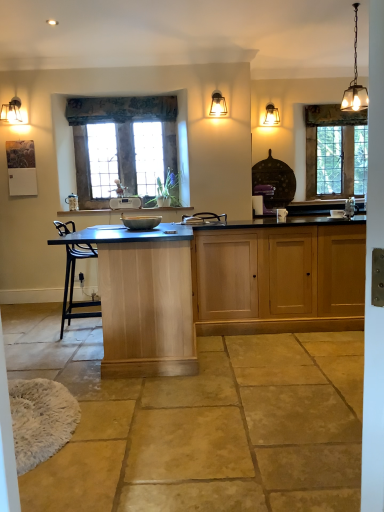
Question: From a real-world perspective, is light oak cabinet at center physically located above or below matte black lampshade at upper left?

Choices:
 (A) above
 (B) below

Answer: (B)

Question: Considering the positions of light oak cabinet at center and matte black lampshade at upper left in the image, is light oak cabinet at center bigger or smaller than matte black lampshade at upper left?

Choices:
 (A) small
 (B) big

Answer: (B)

Question: Which of these objects is positioned farthest from the light oak cabinet at center?

Choices:
 (A) matte glass pendant light at upper right, the third light fixture in the front-to-back sequence
 (B) textured fabric curtain at upper center
 (C) satin nickel faucet at right
 (D) white plastic toaster at center
 (E) stained glass window at center, which appears as the first window when viewed from the front

Answer: (A)

Question: Which of these objects is positioned farthest from the white plastic toaster at center?

Choices:
 (A) matte black lampshade at upper left
 (B) wooden window at right, which appears as the second window when viewed from the front
 (C) matte silver bowl at center
 (D) metallic chain-link light fixture at upper right, which ranks as the 3th light fixture in left-to-right order
 (E) light oak cabinet at center

Answer: (B)